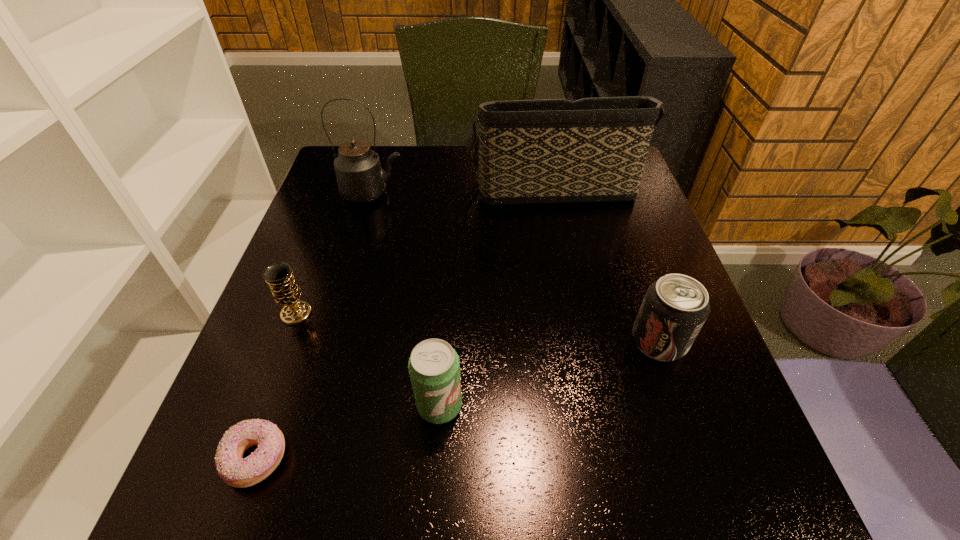
At what (x,y) coordinates should I click in order to perform the action: click on blank region between the left soda can and the farther soda can. Please return your answer as a coordinate pair (x, y). The height and width of the screenshot is (540, 960). Looking at the image, I should click on (549, 373).

Locate an element on the screen. free spot between the nearer soda can and the second shortest object is located at coordinates (368, 360).

I want to click on empty space that is in between the handbag and the nearer soda can, so tap(495, 296).

The width and height of the screenshot is (960, 540). Identify the location of free area in between the left soda can and the kettle. (406, 299).

Find the location of a particular element. The image size is (960, 540). blank region between the nearer soda can and the right soda can is located at coordinates (549, 373).

The height and width of the screenshot is (540, 960). I want to click on vacant area between the handbag and the left soda can, so click(495, 296).

You are a GUI agent. You are given a task and a screenshot of the screen. Output one action in this format:
    pyautogui.click(x=<x>, y=<y>)
    Task: Click on the free space that is in between the kettle and the handbag
    
    Given the screenshot: What is the action you would take?
    pyautogui.click(x=462, y=190)

Identify the location of the fifth closest object to the farther soda can. The width and height of the screenshot is (960, 540). (279, 276).

Locate which object ranks third in proximity to the chalice. Please provide its 2D coordinates. Your answer should be formatted as a tuple, i.e. [(x, y)], where the tuple contains the x and y coordinates of a point satisfying the conditions above.

[(360, 178)]

The image size is (960, 540). I want to click on vacant space that satisfies the following two spatial constraints: 1. spout on the kettle; 2. on the right side of the left soda can, so point(312,406).